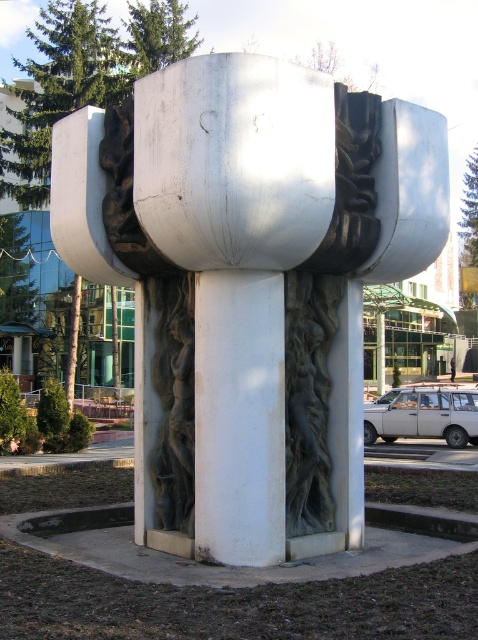
Does white polished stone sculpture at center have a larger size compared to white smooth pillar at center?

Correct, white polished stone sculpture at center is larger in size than white smooth pillar at center.

You are a GUI agent. You are given a task and a screenshot of the screen. Output one action in this format:
    pyautogui.click(x=<x>, y=<y>)
    Task: Click on the white polished stone sculpture at center
    The height and width of the screenshot is (640, 478).
    Given the screenshot: What is the action you would take?
    pyautogui.click(x=250, y=284)

Locate an element on the screen. white polished stone sculpture at center is located at coordinates (250, 284).